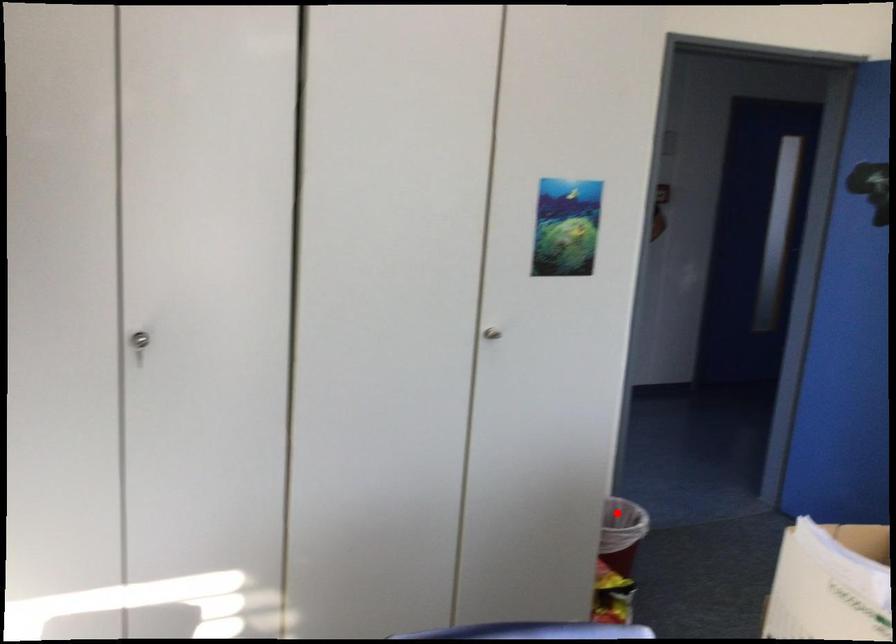
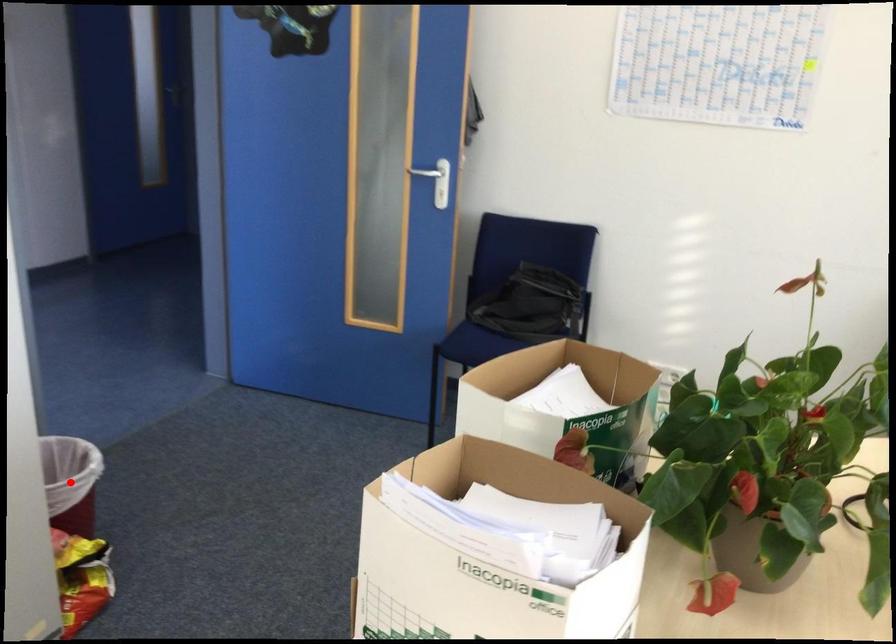
I am providing you with two images of the same scene from different viewpoints. A red point is marked on the first image and another point is marked on the second image. Do the highlighted points in image1 and image2 indicate the same real-world spot?

Yes